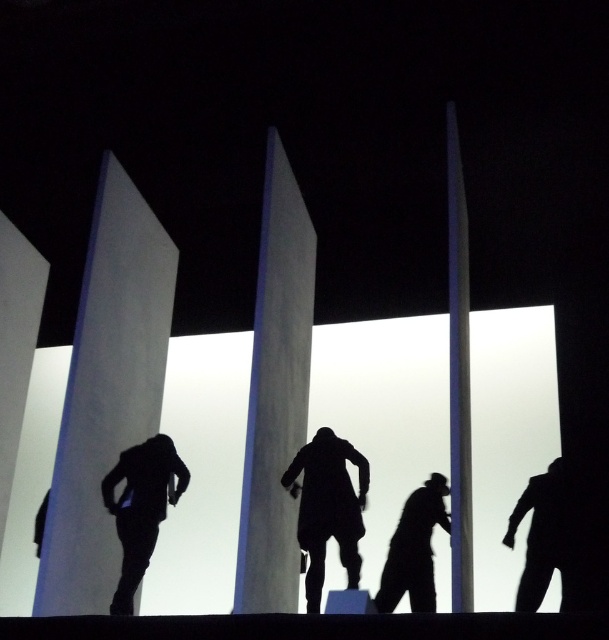
Question: Can you confirm if white smooth pillar at left is positioned to the left of black matte suit at right?

Choices:
 (A) yes
 (B) no

Answer: (A)

Question: Based on their relative distances, which object is farther from the white smooth pillar at left?

Choices:
 (A) silhouette coat at center
 (B) black matte suit at lower left
 (C) black matte suit at lower right

Answer: (C)

Question: Is white smooth pillar at center to the right of silhouette coat at center from the viewer's perspective?

Choices:
 (A) yes
 (B) no

Answer: (A)

Question: Which of the following is the farthest from the observer?

Choices:
 (A) black matte suit at lower right
 (B) white smooth pillar at center

Answer: (A)

Question: Can you confirm if black matte suit at lower left is thinner than black matte suit at lower right?

Choices:
 (A) no
 (B) yes

Answer: (A)

Question: Which point appears farthest from the camera in this image?

Choices:
 (A) (119, 259)
 (B) (530, 548)

Answer: (A)